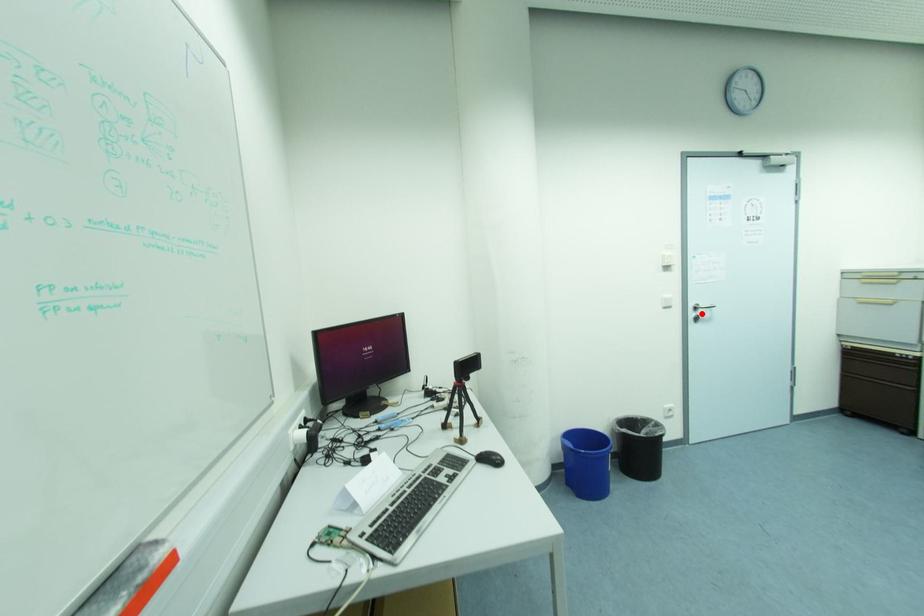
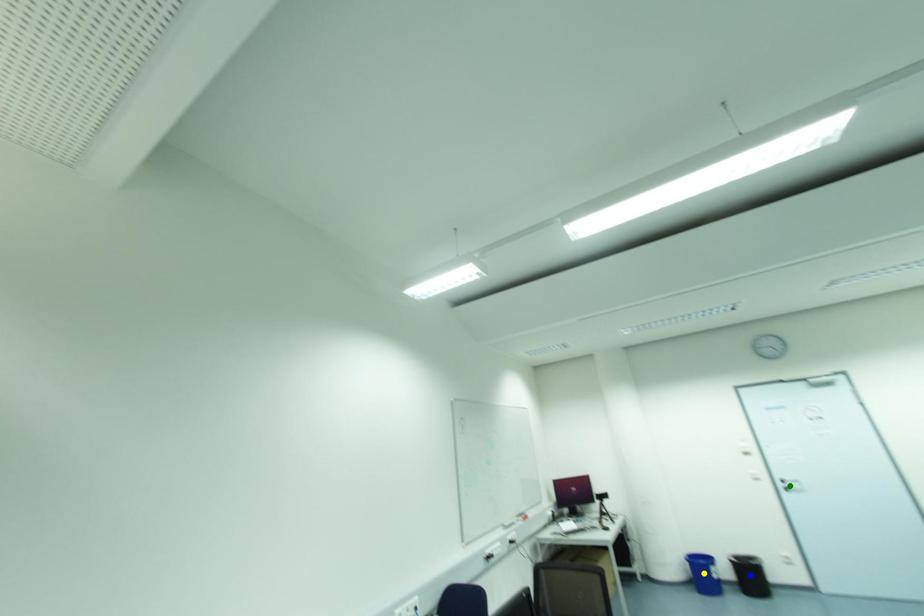
Question: I am providing you with two images of the same scene from different viewpoints. A red point is marked on the first image. You are given multiple points on the second image. In image 2, which mark is for the same physical point as the one in image 1?

Choices:
 (A) yellow point
 (B) blue point
 (C) green point

Answer: (C)